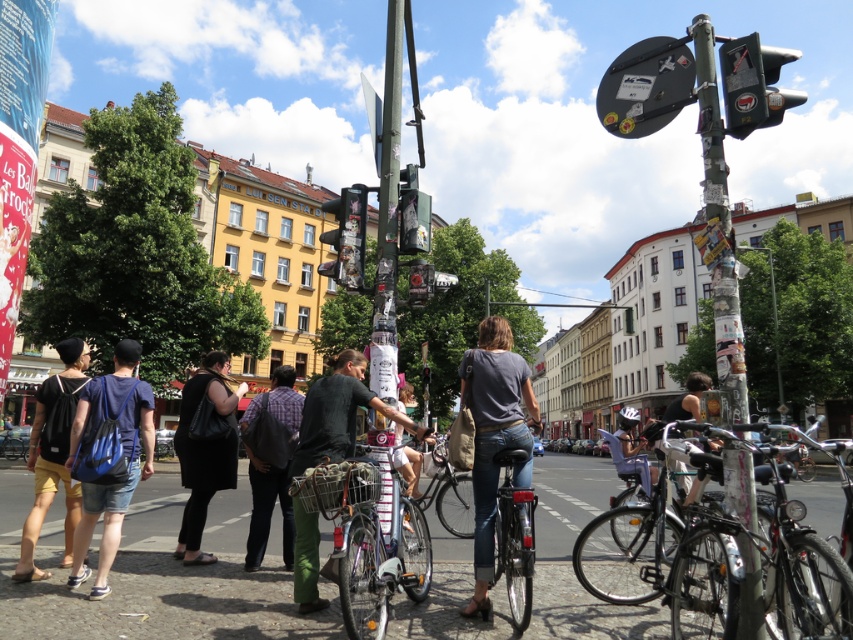
Question: Among these points, which one is farthest from the camera?

Choices:
 (A) (688, 83)
 (B) (109, 564)
 (C) (813, 541)

Answer: (B)

Question: Estimate the real-world distances between objects in this image. Which object is closer to the shiny black bicycle at lower right?

Choices:
 (A) metallic traffic light at center
 (B) matte black shorts at lower left
 (C) sticky paper-covered pole at right
 (D) denim jeans at center

Answer: (D)

Question: Which object is farther from the camera taking this photo?

Choices:
 (A) blue fabric backpack at lower left
 (B) shiny black bicycle at lower right
 (C) metallic traffic light at center
 (D) matte black shorts at lower left

Answer: (C)

Question: Is plaid shirt at center smaller than metallic traffic light at center?

Choices:
 (A) no
 (B) yes

Answer: (B)

Question: Does silver metallic bicycle at right appear on the right side of blue fabric backpack at lower left?

Choices:
 (A) no
 (B) yes

Answer: (B)

Question: From the image, what is the correct spatial relationship of sticky paper-covered pole at right in relation to black leather bag at center?

Choices:
 (A) above
 (B) below

Answer: (A)